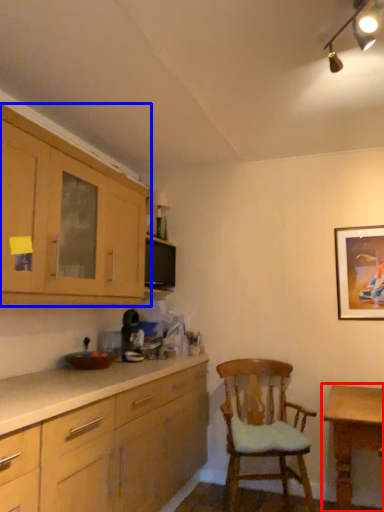
Question: Which object is further to the camera taking this photo, table (highlighted by a red box) or cabinetry (highlighted by a blue box)?

Choices:
 (A) table
 (B) cabinetry

Answer: (A)